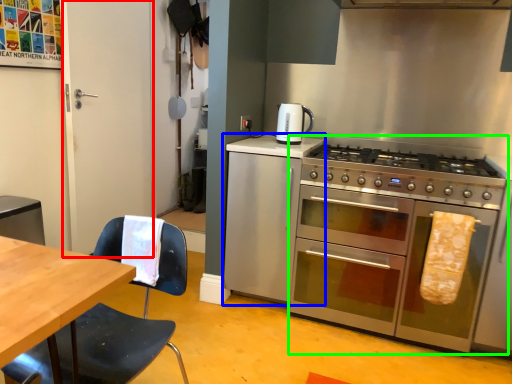
Question: Which is nearer to the glass door (highlighted by a red box)? cabinetry (highlighted by a blue box) or oven (highlighted by a green box).

Choices:
 (A) cabinetry
 (B) oven

Answer: (A)